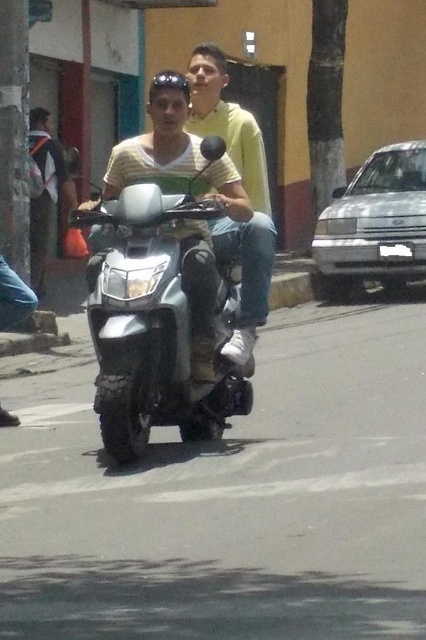
Question: Among these objects, which one is farthest from the camera?

Choices:
 (A) yellow-green shirt at center
 (B) silver metallic scooter at center

Answer: (A)

Question: Which point is closer to the camera?

Choices:
 (A) silver metallic scooter at center
 (B) yellow-green shirt at center

Answer: (A)

Question: Is silver metallic scooter at center above yellow-green shirt at center?

Choices:
 (A) yes
 (B) no

Answer: (B)

Question: Can you confirm if silver metallic scooter at center is positioned to the right of yellow-green shirt at center?

Choices:
 (A) no
 (B) yes

Answer: (A)

Question: Can you confirm if silver metallic scooter at center is bigger than yellow-green shirt at center?

Choices:
 (A) no
 (B) yes

Answer: (B)